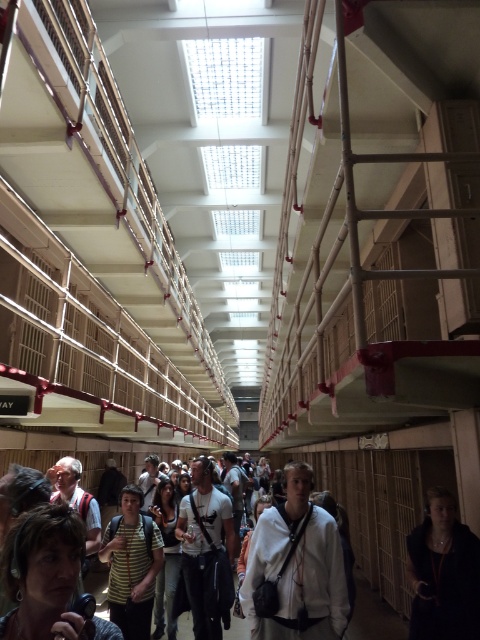
You are standing in the prison cell block and want to pick up both the matte black headphones at lower left and the dark blue jacket at center. Which item should you pick up first to reach the closer one?

You should pick up the matte black headphones at lower left first because it is closer to you than the dark blue jacket at center.

You are standing in the prison cell block of Alcatraz and notice the matte black headphones at lower left. Based on their position, can you determine if they are placed near the floor or the ceiling?

The matte black headphones at lower left are located at point coordinates indicating they are near the floor since the coordinates are closer to the bottom of the image.